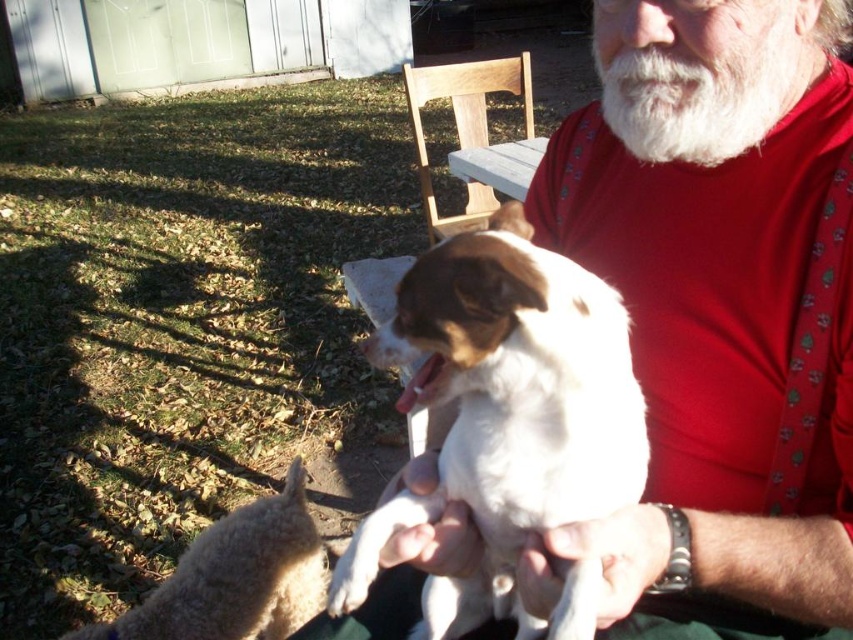
You are a photographer standing in the backyard and want to capture a photo where both the smooth red shirt at center and the white fluffy dog at center are clearly visible. Given their heights, which one should you focus on to ensure both are in frame?

The smooth red shirt at center is taller than the white fluffy dog at center, so focusing on the smooth red shirt at center will ensure both are in frame as the dog is shorter and within the same central area.

Looking at this image, you are a photographer trying to capture a clear shot of the white fluffy dog at center and the white fluffy beard at upper center. Which one would appear larger in your photo?

The white fluffy dog at center would appear larger in the photo because it is closer to the viewer than the white fluffy beard at upper center.